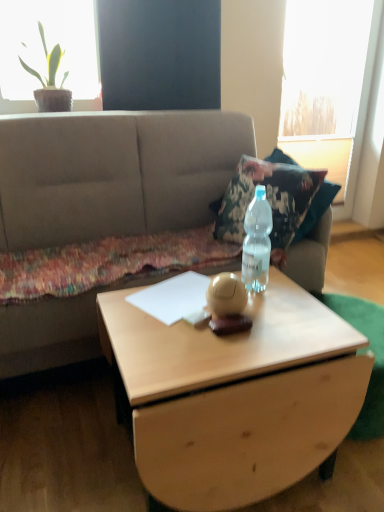
Describe the element at coordinates (257, 242) in the screenshot. I see `clear plastic bottle at center` at that location.

Image resolution: width=384 pixels, height=512 pixels. What do you see at coordinates (48, 46) in the screenshot?
I see `green leafy plant at upper left` at bounding box center [48, 46].

Identify the location of clear plastic bottle at center. The image size is (384, 512). (257, 242).

From a real-world perspective, who is located higher, light wood coffee table at center or beige fabric couch at center?

beige fabric couch at center, from a real-world perspective.

In the image, is light wood coffee table at center positioned in front of or behind beige fabric couch at center?

light wood coffee table at center is in front of beige fabric couch at center.

From the picture: Is light wood coffee table at center to the left of beige fabric couch at center from the viewer's perspective?

No, light wood coffee table at center is not to the left of beige fabric couch at center.

Which of these two, light wood coffee table at center or beige fabric couch at center, is bigger?

Bigger between the two is beige fabric couch at center.

From the image's perspective, is green leafy plant at upper left below beige fabric couch at center?

No, from the image's perspective, green leafy plant at upper left is not beneath beige fabric couch at center.

Considering the positions of objects green leafy plant at upper left and beige fabric couch at center in the image provided, who is more to the left, green leafy plant at upper left or beige fabric couch at center?

green leafy plant at upper left.

How many degrees apart are the facing directions of green leafy plant at upper left and beige fabric couch at center?

The angle between the facing direction of green leafy plant at upper left and the facing direction of beige fabric couch at center is 0.13 degrees.

From the picture: Is the surface of beige fabric couch at center in direct contact with clear plastic bottle at center?

There is a gap between beige fabric couch at center and clear plastic bottle at center.

Between point (68, 147) and point (265, 257), which one is positioned in front?

The point (265, 257) is closer.

Does beige fabric couch at center have a greater width compared to clear plastic bottle at center?

Indeed, beige fabric couch at center has a greater width compared to clear plastic bottle at center.

Is beige fabric couch at center completely or partially outside of clear plastic bottle at center?

beige fabric couch at center is positioned outside clear plastic bottle at center.

Is transparent glass window at upper right at the back of light wood coffee table at center?

That's not correct — light wood coffee table at center is not looking away from transparent glass window at upper right.

Is light wood coffee table at center positioned before transparent glass window at upper right?

Yes, it is in front of transparent glass window at upper right.

Is light wood coffee table at center directly adjacent to transparent glass window at upper right?

No, light wood coffee table at center is not touching transparent glass window at upper right.

In terms of size, does transparent glass window at upper right appear bigger or smaller than green leafy plant at upper left?

transparent glass window at upper right is bigger than green leafy plant at upper left.

Identify the location of window screen to the left of transparent glass window at upper right. [48, 46].

From a real-world perspective, is transparent glass window at upper right above or below green leafy plant at upper left?

transparent glass window at upper right is situated lower than green leafy plant at upper left in the real world.

How far apart are transparent glass window at upper right and green leafy plant at upper left?

transparent glass window at upper right is 10.00 feet from green leafy plant at upper left.

Does point (259, 211) lie behind point (221, 489)?

Yes, it is.

Considering the positions of objects clear plastic bottle at center and light wood coffee table at center in the image provided, who is behind, clear plastic bottle at center or light wood coffee table at center?

clear plastic bottle at center is further away from the camera.

Would you say light wood coffee table at center is part of clear plastic bottle at center's contents?

No, light wood coffee table at center is not surrounded by clear plastic bottle at center.

The width and height of the screenshot is (384, 512). In order to click on coffee table that appears on the left of clear plastic bottle at center in this screenshot , I will do `click(236, 396)`.

Which is in front, point (347, 103) or point (260, 284)?

The point (260, 284) is closer to the camera.

Is transparent glass window at upper right wider than clear plastic bottle at center?

No.

In the scene shown: From a real-world perspective, which object rests below the other?

clear plastic bottle at center.

Where is `coffee table that appears below the beige fabric couch at center (from a real-world perspective)`? The width and height of the screenshot is (384, 512). coffee table that appears below the beige fabric couch at center (from a real-world perspective) is located at coordinates (236, 396).

Find the location of `window screen behind the beige fabric couch at center`. window screen behind the beige fabric couch at center is located at coordinates (48, 46).

Estimate the real-world distances between objects in this image. Which object is closer to transparent glass window at upper right, beige fabric couch at center or light wood coffee table at center?

Based on the image, beige fabric couch at center appears to be nearer to transparent glass window at upper right.

Which object lies further to the anchor point light wood coffee table at center, beige fabric couch at center or transparent glass window at upper right?

Based on the image, transparent glass window at upper right appears to be further to light wood coffee table at center.

Considering their positions, is green leafy plant at upper left positioned further to light wood coffee table at center than transparent glass window at upper right?

transparent glass window at upper right is positioned further to the anchor light wood coffee table at center.

Looking at this image, considering their positions, is light wood coffee table at center positioned further to clear plastic bottle at center than transparent glass window at upper right?

transparent glass window at upper right is further to clear plastic bottle at center.

When comparing their distances from clear plastic bottle at center, does light wood coffee table at center or beige fabric couch at center seem closer?

light wood coffee table at center.

From the image, which object appears to be nearer to beige fabric couch at center, clear plastic bottle at center or light wood coffee table at center?

Among the two, clear plastic bottle at center is located nearer to beige fabric couch at center.

Looking at the image, which one is located closer to green leafy plant at upper left, light wood coffee table at center or transparent glass window at upper right?

Among the two, light wood coffee table at center is located nearer to green leafy plant at upper left.

Which object lies further to the anchor point green leafy plant at upper left, light wood coffee table at center or beige fabric couch at center?

light wood coffee table at center lies further to green leafy plant at upper left than the other object.

Image resolution: width=384 pixels, height=512 pixels. Identify the location of bottle that lies between green leafy plant at upper left and light wood coffee table at center from top to bottom. (257, 242).

At what (x,y) coordinates should I click in order to perform the action: click on bottle between beige fabric couch at center and light wood coffee table at center vertically. Please return your answer as a coordinate pair (x, y). Image resolution: width=384 pixels, height=512 pixels. Looking at the image, I should click on (257, 242).

At what (x,y) coordinates should I click in order to perform the action: click on window screen positioned between light wood coffee table at center and transparent glass window at upper right from near to far. Please return your answer as a coordinate pair (x, y). The width and height of the screenshot is (384, 512). Looking at the image, I should click on (x=48, y=46).

Where is `bottle between light wood coffee table at center and transparent glass window at upper right along the z-axis`? The height and width of the screenshot is (512, 384). bottle between light wood coffee table at center and transparent glass window at upper right along the z-axis is located at coordinates (257, 242).